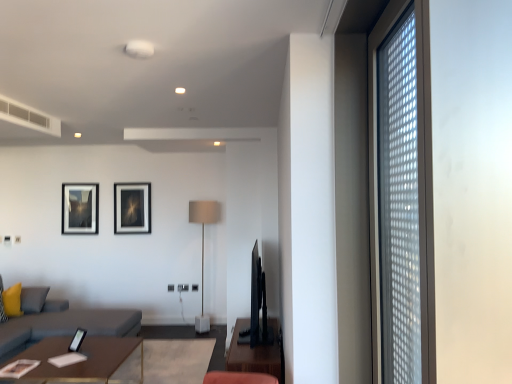
What are the coordinates of `free location in front of matte black picture frame at lower center, the 3th picture frame from the top` in the screenshot? It's located at (62, 354).